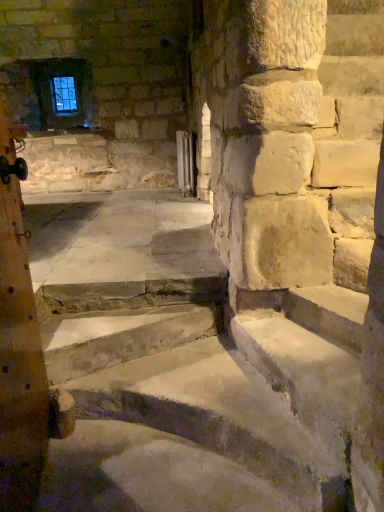
What do you see at coordinates (193, 403) in the screenshot? The height and width of the screenshot is (512, 384). I see `smooth stone stairs at center` at bounding box center [193, 403].

In order to face wooden post at left, should I rotate leftwards or rightwards?

You should look left and rotate roughly 26.244 degrees.

Describe the element at coordinates (184, 162) in the screenshot. I see `metallic radiator at center` at that location.

At what (x,y) coordinates should I click in order to perform the action: click on smooth stone stairs at center. Please return your answer as a coordinate pair (x, y). The height and width of the screenshot is (512, 384). Looking at the image, I should click on (193, 403).

From a real-world perspective, which is physically below, clear glass window screen at upper left or smooth stone stairs at center?

smooth stone stairs at center, from a real-world perspective.

Considering the sizes of clear glass window screen at upper left and smooth stone stairs at center in the image, is clear glass window screen at upper left taller or shorter than smooth stone stairs at center?

clear glass window screen at upper left is taller than smooth stone stairs at center.

Which object is further away from the camera taking this photo, clear glass window screen at upper left or smooth stone stairs at center?

clear glass window screen at upper left is further away from the camera.

Which is less distant, (67,98) or (175,448)?

Positioned in front is point (175,448).

Considering the sizes of objects smooth stone stairs at center and metallic radiator at center in the image provided, who is taller, smooth stone stairs at center or metallic radiator at center?

metallic radiator at center.

Can you confirm if smooth stone stairs at center is smaller than metallic radiator at center?

No.

Looking at this image, relative to metallic radiator at center, is smooth stone stairs at center in front or behind?

Visually, smooth stone stairs at center is located in front of metallic radiator at center.

Is smooth stone stairs at center oriented away from metallic radiator at center?

smooth stone stairs at center is not turned away from metallic radiator at center.

Looking at this image, how many degrees apart are the facing directions of clear glass window screen at upper left and metallic radiator at center?

84.3 degrees.

How much distance is there between clear glass window screen at upper left and metallic radiator at center?

They are 5.66 feet apart.

Could metallic radiator at center be considered to be inside clear glass window screen at upper left?

Actually, metallic radiator at center is outside clear glass window screen at upper left.

Is clear glass window screen at upper left further to camera compared to metallic radiator at center?

Yes.

Do you think clear glass window screen at upper left is within wooden post at left, or outside of it?

clear glass window screen at upper left cannot be found inside wooden post at left.

Is clear glass window screen at upper left directly adjacent to wooden post at left?

No, clear glass window screen at upper left is not touching wooden post at left.

From the picture: Considering the positions of objects clear glass window screen at upper left and wooden post at left in the image provided, who is more to the right, clear glass window screen at upper left or wooden post at left?

From the viewer's perspective, wooden post at left appears more on the right side.

From a real-world perspective, who is located higher, clear glass window screen at upper left or wooden post at left?

In real-world perspective, clear glass window screen at upper left is above.

Is clear glass window screen at upper left a part of wooden post at left?

No, wooden post at left does not contain clear glass window screen at upper left.

Does wooden post at left have a greater width compared to clear glass window screen at upper left?

Yes.

In the scene shown: Is clear glass window screen at upper left at the back of wooden post at left?

No, clear glass window screen at upper left is not at the back of wooden post at left.

Is wooden post at left next to clear glass window screen at upper left?

wooden post at left is not next to clear glass window screen at upper left, and they're not touching.

Which is behind, metallic radiator at center or smooth stone stairs at center?

Positioned behind is metallic radiator at center.

Is point (187, 173) closer or farther from the camera than point (224, 451)?

Point (187, 173) is positioned farther from the camera compared to point (224, 451).

Is smooth stone stairs at center inside metallic radiator at center?

Actually, smooth stone stairs at center is outside metallic radiator at center.

Which of these two, metallic radiator at center or smooth stone stairs at center, is wider?

smooth stone stairs at center is wider.

From a real-world perspective, is smooth stone stairs at center positioned above or below wooden post at left?

smooth stone stairs at center is below wooden post at left.

Is smooth stone stairs at center not near wooden post at left?

No, there isn't a large distance between smooth stone stairs at center and wooden post at left.

From the image's perspective, which is above, smooth stone stairs at center or wooden post at left?

wooden post at left.

Based on the photo, which object is closer to the camera, smooth stone stairs at center or wooden post at left?

wooden post at left is in front.

The height and width of the screenshot is (512, 384). I want to click on window screen behind the smooth stone stairs at center, so click(63, 94).

Find the location of `stairwell to the left of metallic radiator at center`. stairwell to the left of metallic radiator at center is located at coordinates (193, 403).

Considering their positions, is smooth stone stairs at center positioned closer to clear glass window screen at upper left than wooden post at left?

The object closer to clear glass window screen at upper left is wooden post at left.

When comparing their distances from metallic radiator at center, does smooth stone stairs at center or clear glass window screen at upper left seem closer?

clear glass window screen at upper left lies closer to metallic radiator at center than the other object.

When comparing their distances from clear glass window screen at upper left, does metallic radiator at center or smooth stone stairs at center seem further?

Among the two, smooth stone stairs at center is located further to clear glass window screen at upper left.

When comparing their distances from metallic radiator at center, does clear glass window screen at upper left or wooden post at left seem closer?

Among the two, clear glass window screen at upper left is located nearer to metallic radiator at center.

Considering their positions, is clear glass window screen at upper left positioned closer to smooth stone stairs at center than wooden post at left?

wooden post at left is positioned closer to the anchor smooth stone stairs at center.

When comparing their distances from clear glass window screen at upper left, does wooden post at left or metallic radiator at center seem closer?

metallic radiator at center is positioned closer to the anchor clear glass window screen at upper left.

From the image, which object appears to be nearer to clear glass window screen at upper left, smooth stone stairs at center or metallic radiator at center?

metallic radiator at center lies closer to clear glass window screen at upper left than the other object.

Estimate the real-world distances between objects in this image. Which object is closer to wooden post at left, metallic radiator at center or clear glass window screen at upper left?

metallic radiator at center lies closer to wooden post at left than the other object.

Where is `stairwell between wooden post at left and metallic radiator at center from front to back`? stairwell between wooden post at left and metallic radiator at center from front to back is located at coordinates (193, 403).

Image resolution: width=384 pixels, height=512 pixels. What are the coordinates of `door between wooden post at left and clear glass window screen at upper left in the front-back direction` in the screenshot? It's located at (184, 162).

The height and width of the screenshot is (512, 384). I want to click on stairwell between wooden post at left and clear glass window screen at upper left from front to back, so click(x=193, y=403).

The image size is (384, 512). In order to click on door between smooth stone stairs at center and clear glass window screen at upper left in the front-back direction in this screenshot , I will do `click(184, 162)`.